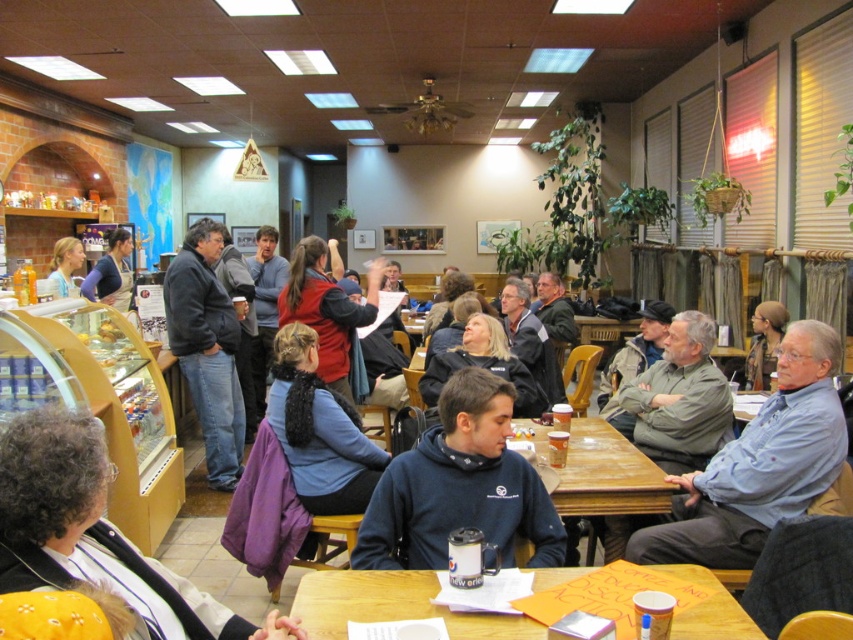
Which is more to the right, navy blue hoodie at center or wooden table at lower center?

Positioned to the right is wooden table at lower center.

Which is behind, point (401, 477) or point (479, 632)?

Point (401, 477)

Who is more forward, (508, 388) or (339, 605)?

Point (339, 605)

This screenshot has width=853, height=640. I want to click on navy blue hoodie at center, so 460,486.

Can you confirm if navy blue hoodie at center is taller than matte blue shirt at upper left?

Indeed, navy blue hoodie at center has a greater height compared to matte blue shirt at upper left.

Can you confirm if navy blue hoodie at center is thinner than matte blue shirt at upper left?

No.

The height and width of the screenshot is (640, 853). Identify the location of navy blue hoodie at center. (460, 486).

Find the location of a particular element. The height and width of the screenshot is (640, 853). navy blue hoodie at center is located at coordinates (460, 486).

Is wooden table at center thinner than matte blue shirt at upper left?

In fact, wooden table at center might be wider than matte blue shirt at upper left.

Between wooden table at center and matte blue shirt at upper left, which one has more height?

matte blue shirt at upper left is taller.

Is point (614, 472) closer to viewer compared to point (61, 237)?

That is True.

Identify the location of wooden table at center. (607, 476).